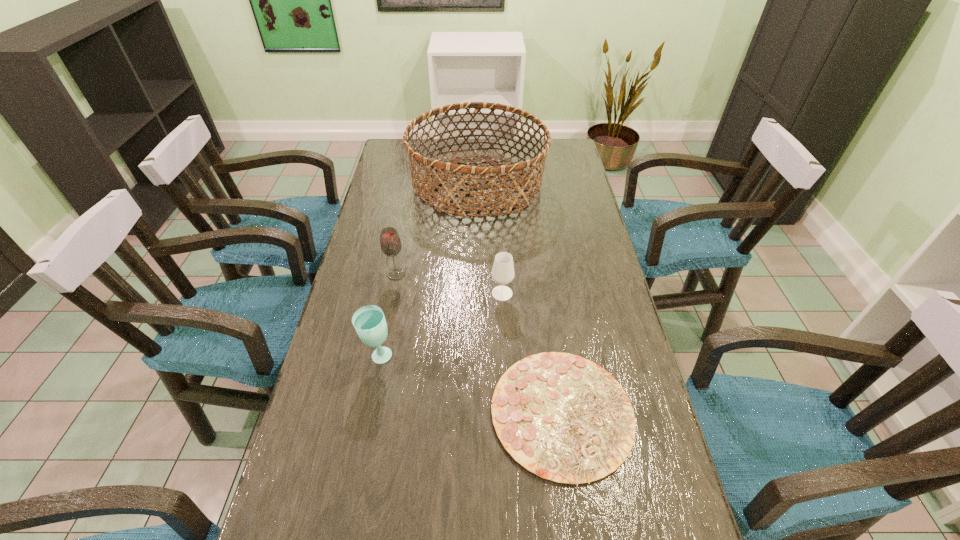
Locate which object ranks in proximity to the second farthest object. Please provide its 2D coordinates. Your answer should be formatted as a tuple, i.e. [(x, y)], where the tuple contains the x and y coordinates of a point satisfying the conditions above.

[(444, 168)]

At what (x,y) coordinates should I click in order to perform the action: click on object that ranks as the fourth closest to the nearest glass. Please return your answer as a coordinate pair (x, y). The image size is (960, 540). Looking at the image, I should click on (444, 168).

Identify which glass is the closest to the nearest glass. Please provide its 2D coordinates. Your answer should be formatted as a tuple, i.e. [(x, y)], where the tuple contains the x and y coordinates of a point satisfying the conditions above.

[(390, 242)]

Select which glass is the closest to the nearest glass. Please provide its 2D coordinates. Your answer should be formatted as a tuple, i.e. [(x, y)], where the tuple contains the x and y coordinates of a point satisfying the conditions above.

[(390, 242)]

Locate an element on the screen. The height and width of the screenshot is (540, 960). free region that satisfies the following two spatial constraints: 1. on the front side of the pizza; 2. on the right side of the nearest glass is located at coordinates 368,414.

At what (x,y) coordinates should I click in order to perform the action: click on free point that satisfies the following two spatial constraints: 1. on the back side of the farthest glass; 2. on the left side of the nearest glass. Please return your answer as a coordinate pair (x, y). Looking at the image, I should click on (395, 274).

At what (x,y) coordinates should I click in order to perform the action: click on vacant space that satisfies the following two spatial constraints: 1. on the front side of the third nearest object; 2. on the right side of the farthest object. Please return your answer as a coordinate pair (x, y). The height and width of the screenshot is (540, 960). Looking at the image, I should click on (476, 293).